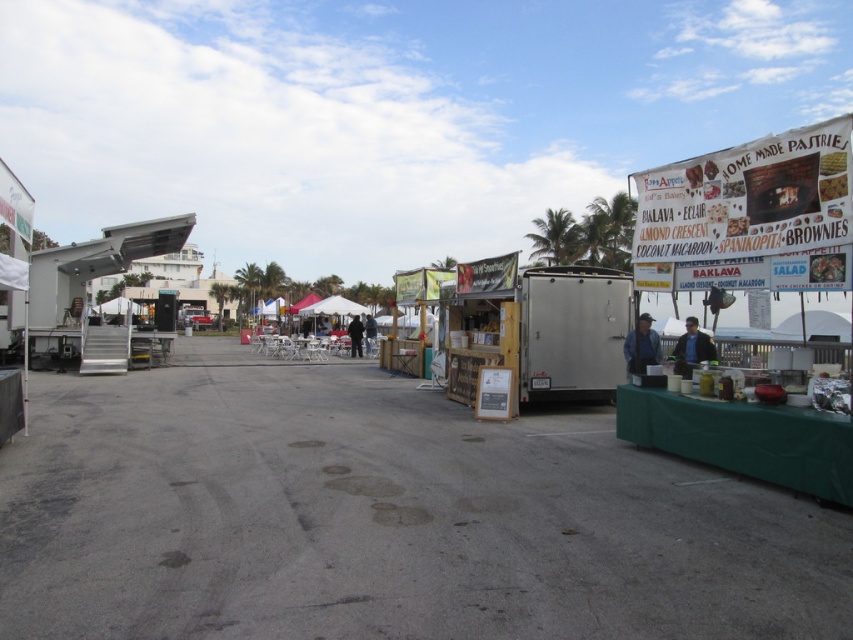
Question: In this image, where is silver metallic food truck at center located relative to blue fabric vendor at right?

Choices:
 (A) right
 (B) left

Answer: (B)

Question: Which object appears farthest from the camera in this image?

Choices:
 (A) black leather jacket at right
 (B) silver metallic food truck at center
 (C) blue fabric vendor at right
 (D) white fabric canopy at center

Answer: (D)

Question: Which object appears closest to the camera in this image?

Choices:
 (A) black leather jacket at right
 (B) white fabric canopy at center
 (C) silver metallic food truck at center

Answer: (A)

Question: Does silver metallic food truck at center have a lesser width compared to blue fabric vendor at right?

Choices:
 (A) no
 (B) yes

Answer: (B)

Question: Can you confirm if silver metallic food truck at center is positioned to the left of black leather jacket at right?

Choices:
 (A) yes
 (B) no

Answer: (A)

Question: Which point is closer to the camera?

Choices:
 (A) white fabric canopy at center
 (B) blue fabric vendor at right

Answer: (B)